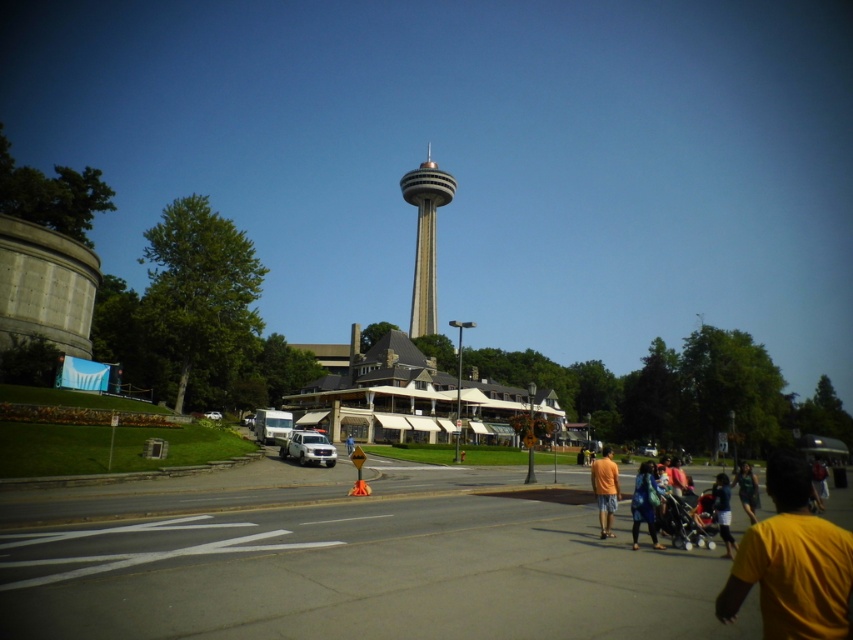
Question: Which point is closer to the camera?

Choices:
 (A) gray concrete tower at center
 (B) orange fabric shorts at lower right
 (C) dark blue fabric at lower right
 (D) metallic silver stroller at lower right

Answer: (C)

Question: Can you confirm if yellow matte shirt at lower right is smaller than blue fabric bag at lower center?

Choices:
 (A) no
 (B) yes

Answer: (B)

Question: Is yellow matte shirt at lower right wider than blue fabric bag at lower center?

Choices:
 (A) no
 (B) yes

Answer: (A)

Question: Considering the relative positions of orange fabric shorts at lower right and green fabric shirt at lower right in the image provided, where is orange fabric shorts at lower right located with respect to green fabric shirt at lower right?

Choices:
 (A) right
 (B) left

Answer: (B)

Question: Estimate the real-world distances between objects in this image. Which object is closer to the yellow matte shirt at lower right?

Choices:
 (A) blue fabric bag at lower center
 (B) dark blue fabric at lower right
 (C) orange fabric shorts at lower right
 (D) metallic silver stroller at lower right

Answer: (D)

Question: Which object is closer to the camera taking this photo?

Choices:
 (A) green fabric shirt at lower right
 (B) blue fabric bag at lower center

Answer: (B)